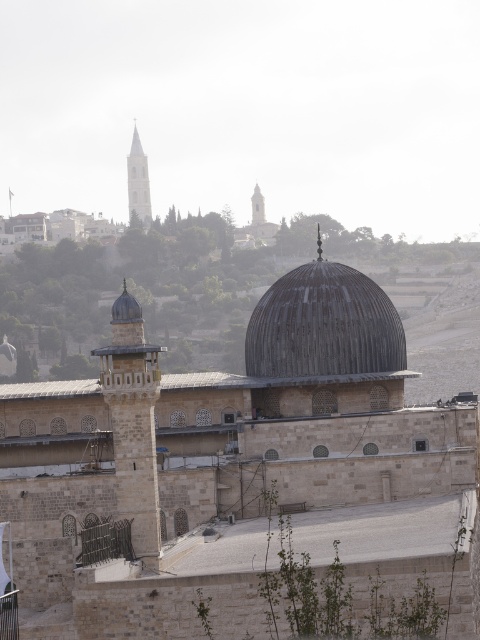
You are an architect analyzing the layout of this historic site. You need to determine the spatial relationship between the smooth white tower at upper left and the smooth stone minaret at center. Which one is positioned closer to the observer?

The smooth white tower at upper left is closer to the viewer than the smooth stone minaret at center, so the smooth white tower at upper left is positioned closer to the observer.

You are an architect analyzing the layout of this historic site. Based on the image, which object takes up more area in the scene between the rusty metal dome at center and the smooth stone minaret at center?

The smooth stone minaret at center occupies more space than the rusty metal dome at center according to the description.

You are a tourist standing in front of the historic site. You notice two structures in the foreground. Which one is shorter between the rusty metal dome at center and the smooth stone minaret at center?

The rusty metal dome at center is shorter than the smooth stone minaret at center.